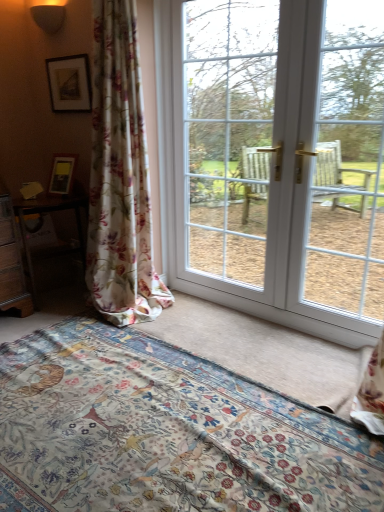
This screenshot has height=512, width=384. Find the location of `floral fabric bed at lower center`. floral fabric bed at lower center is located at coordinates (165, 433).

Measure the distance between point [52,14] and camera.

The depth of point [52,14] is 2.62 meters.

I want to click on clear glass door at right, the second window screen from the left, so click(349, 165).

What do you see at coordinates (45, 212) in the screenshot? I see `wooden table at left` at bounding box center [45, 212].

Image resolution: width=384 pixels, height=512 pixels. Describe the element at coordinates (275, 159) in the screenshot. I see `white glossy door at center` at that location.

This screenshot has width=384, height=512. Identify the location of matte black picture frame at upper left. (69, 83).

Does floral fabric bed at lower center have a smaller size compared to white glass window at center, the 1th window screen from the left?

Correct, floral fabric bed at lower center occupies less space than white glass window at center, the 1th window screen from the left.

Which window screen is the 2nd one when counting from the back of the floral fabric bed at lower center? Please provide its 2D coordinates.

[(228, 134)]

Does floral fabric bed at lower center have a lesser height compared to white glass window at center, the 2th window screen when ordered from right to left?

Yes.

How many degrees apart are the facing directions of floral fabric bed at lower center and white glass window at center, the 2th window screen when ordered from right to left?

There is a 2.74-degree angle between the facing directions of floral fabric bed at lower center and white glass window at center, the 2th window screen when ordered from right to left.

Based on their positions, is floral fabric curtain at left located to the left or right of clear glass door at right, the first window screen when ordered from right to left?

From the image, it's evident that floral fabric curtain at left is to the left of clear glass door at right, the first window screen when ordered from right to left.

Is floral fabric curtain at left not near clear glass door at right, the second window screen from the left?

Yes, floral fabric curtain at left and clear glass door at right, the second window screen from the left, are located far from each other.

Considering the sizes of floral fabric curtain at left and clear glass door at right, the second window screen from the left, in the image, is floral fabric curtain at left taller or shorter than clear glass door at right, the second window screen from the left,?

Considering their sizes, floral fabric curtain at left has more height than clear glass door at right, the second window screen from the left.

Is floral fabric curtain at left wider or thinner than clear glass door at right, the first window screen when ordered from right to left?

Considering their sizes, floral fabric curtain at left looks broader than clear glass door at right, the first window screen when ordered from right to left.

Is matte black picture frame at upper left facing away from white glossy door at center?

No.

In terms of width, does matte black picture frame at upper left look wider or thinner when compared to white glossy door at center?

Considering their sizes, matte black picture frame at upper left looks slimmer than white glossy door at center.

From the picture: Are matte black picture frame at upper left and white glossy door at center far apart?

Actually, matte black picture frame at upper left and white glossy door at center are a little close together.

From a real-world perspective, relative to white glass window at center, the 2th window screen when ordered from right to left, is matte black sconce at upper left vertically above or below?

Clearly, from a real-world perspective, matte black sconce at upper left is above white glass window at center, the 2th window screen when ordered from right to left.

Considering their positions, is matte black sconce at upper left located in front of or behind white glass window at center, the 2th window screen when ordered from right to left?

In the image, matte black sconce at upper left appears behind white glass window at center, the 2th window screen when ordered from right to left.

Can you confirm if matte black sconce at upper left is taller than white glass window at center, the 2th window screen when ordered from right to left?

No.

Which window screen is the 1st one when counting from the right side of the matte black sconce at upper left? Please provide its 2D coordinates.

[(228, 134)]

What's the angular difference between matte black picture frame at upper left and wooden table at left's facing directions?

matte black picture frame at upper left and wooden table at left are facing 79.1 degrees away from each other.

Which of these two, matte black picture frame at upper left or wooden table at left, is bigger?

wooden table at left is bigger.

Is matte black picture frame at upper left completely or partially outside of wooden table at left?

Yes, matte black picture frame at upper left is outside of wooden table at left.

Is floral fabric curtain at left inside or outside of wooden table at left?

floral fabric curtain at left is located beyond the bounds of wooden table at left.

Does floral fabric curtain at left appear on the right side of wooden table at left?

Yes, floral fabric curtain at left is to the right of wooden table at left.

Considering the relative sizes of floral fabric curtain at left and wooden table at left in the image provided, is floral fabric curtain at left shorter than wooden table at left?

In fact, floral fabric curtain at left may be taller than wooden table at left.

How many degrees apart are the facing directions of floral fabric curtain at left and wooden table at left?

77.2 degrees.

From the image's perspective, who appears lower, wooden table at left or matte black sconce at upper left?

wooden table at left appears lower in the image.

From a real-world perspective, which is physically below, wooden table at left or matte black sconce at upper left?

wooden table at left is physically lower.

Which is behind, wooden table at left or matte black sconce at upper left?

matte black sconce at upper left is behind.

Locate an element on the screen. The width and height of the screenshot is (384, 512). the 1st window screen to the right of the floral fabric bed at lower center, counting from the anchor's position is located at coordinates (228, 134).

You are a GUI agent. You are given a task and a screenshot of the screen. Output one action in this format:
    pyautogui.click(x=<x>, y=<y>)
    Task: Click on the window screen below the floral fabric curtain at left (from the image's perspective)
    
    Given the screenshot: What is the action you would take?
    pyautogui.click(x=349, y=165)

Considering their positions, is wooden table at left positioned further to clear glass door at right, the first window screen when ordered from right to left, than floral fabric bed at lower center?

floral fabric bed at lower center is further to clear glass door at right, the first window screen when ordered from right to left.

Considering their positions, is white glass window at center, the 2th window screen when ordered from right to left, positioned closer to floral fabric bed at lower center than wooden table at left?

wooden table at left is closer to floral fabric bed at lower center.

Estimate the real-world distances between objects in this image. Which object is closer to wooden table at left, clear glass door at right, the second window screen from the left, or white glossy door at center?

white glossy door at center is closer to wooden table at left.

Estimate the real-world distances between objects in this image. Which object is closer to floral fabric bed at lower center, matte black sconce at upper left or matte black picture frame at upper left?

Among the two, matte black picture frame at upper left is located nearer to floral fabric bed at lower center.

Which object lies further to the anchor point white glossy door at center, clear glass door at right, the second window screen from the left, or white glass window at center, the 2th window screen when ordered from right to left?

clear glass door at right, the second window screen from the left, is further to white glossy door at center.

Estimate the real-world distances between objects in this image. Which object is closer to floral fabric bed at lower center, clear glass door at right, the first window screen when ordered from right to left, or floral fabric curtain at left?

floral fabric curtain at left is closer to floral fabric bed at lower center.

Which object lies further to the anchor point matte black picture frame at upper left, clear glass door at right, the first window screen when ordered from right to left, or white glossy door at center?

Based on the image, clear glass door at right, the first window screen when ordered from right to left, appears to be further to matte black picture frame at upper left.

When comparing their distances from white glass window at center, the 2th window screen when ordered from right to left, does clear glass door at right, the first window screen when ordered from right to left, or matte black picture frame at upper left seem closer?

matte black picture frame at upper left.

You are a GUI agent. You are given a task and a screenshot of the screen. Output one action in this format:
    pyautogui.click(x=<x>, y=<y>)
    Task: Click on the curtain between matte black picture frame at upper left and floral fabric bed at lower center in the vertical direction
    The width and height of the screenshot is (384, 512).
    Given the screenshot: What is the action you would take?
    pyautogui.click(x=120, y=177)

Where is `window screen between matte black picture frame at upper left and white glossy door at center in the horizontal direction`? The height and width of the screenshot is (512, 384). window screen between matte black picture frame at upper left and white glossy door at center in the horizontal direction is located at coordinates [228, 134].

What are the coordinates of `window screen situated between floral fabric curtain at left and white glossy door at center from left to right` in the screenshot? It's located at (228, 134).

Identify the location of picture frame between matte black sconce at upper left and wooden table at left in the vertical direction. (69, 83).